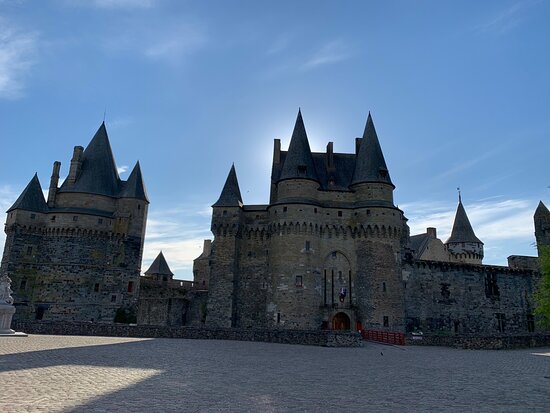
The width and height of the screenshot is (550, 413). I want to click on doorways, so click(346, 327), click(32, 313), click(125, 305).